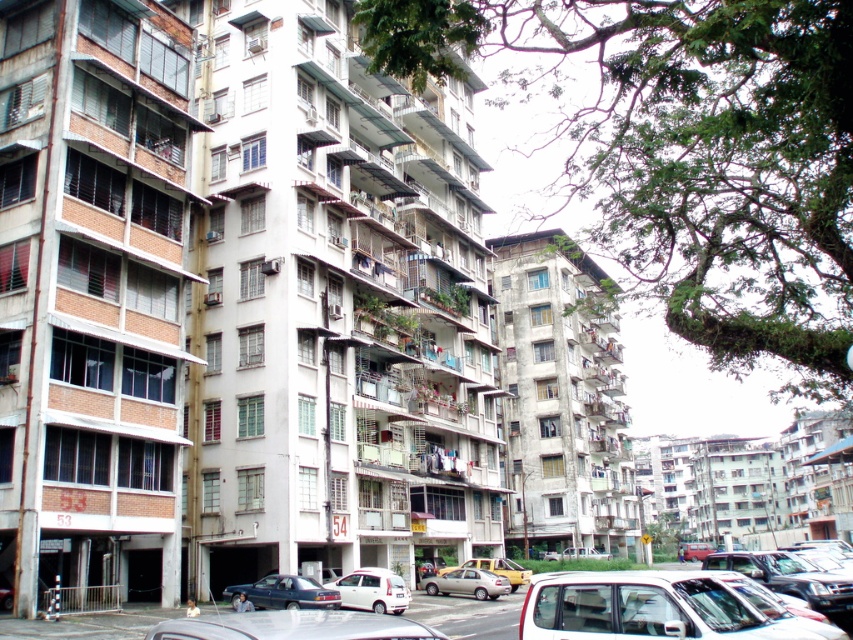
Question: Among these objects, which one is nearest to the camera?

Choices:
 (A) silver metallic sedan at center
 (B) white matte car at lower right
 (C) white matte pickup truck at center
 (D) dark blue metallic car at lower center

Answer: (B)

Question: Estimate the real-world distances between objects in this image. Which object is farther from the white matte pickup truck at center?

Choices:
 (A) white matte car at lower right
 (B) matte red car at center
 (C) white matte car at lower center

Answer: (C)

Question: Can you confirm if dark blue metallic car at lower center is wider than silver metallic sedan at center?

Choices:
 (A) yes
 (B) no

Answer: (A)

Question: Among these points, which one is nearest to the camera?

Choices:
 (A) (289, 577)
 (B) (621, 632)
 (C) (601, 552)
 (D) (468, 572)

Answer: (B)

Question: Is white matte car at lower right smaller than yellow matte taxi at center?

Choices:
 (A) yes
 (B) no

Answer: (B)

Question: Does dark blue metallic car at lower center have a greater width compared to white matte car at center?

Choices:
 (A) yes
 (B) no

Answer: (A)